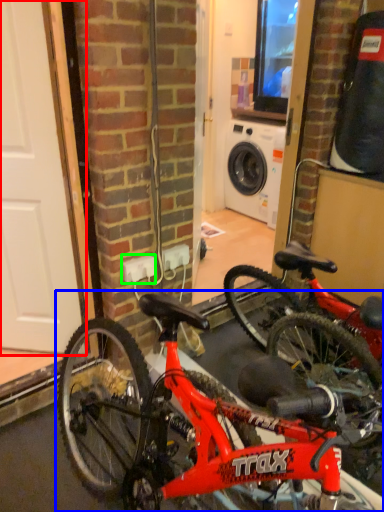
Question: Which object is positioned farthest from door (highlighted by a red box)? Select from bicycle (highlighted by a blue box) and electric outlet (highlighted by a green box).

Choices:
 (A) bicycle
 (B) electric outlet

Answer: (A)